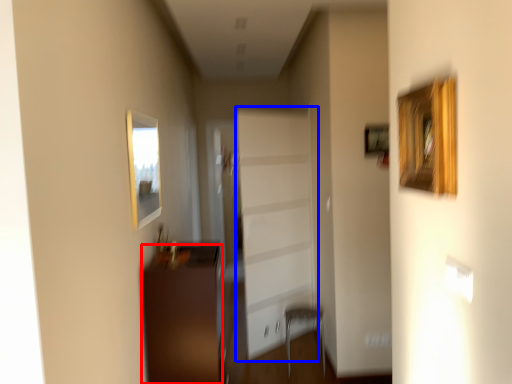
Question: Which of the following is the closest to the observer, furniture (highlighted by a red box) or garage door (highlighted by a blue box)?

Choices:
 (A) furniture
 (B) garage door

Answer: (A)